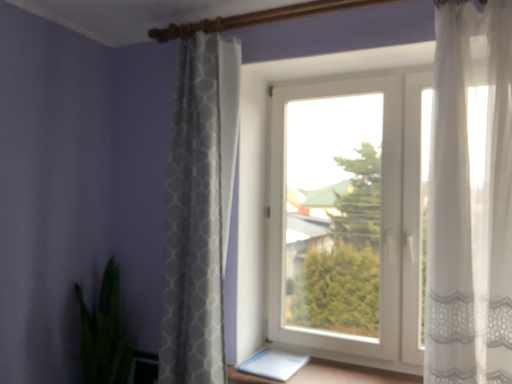
Question: From the image's perspective, would you say white textured curtain at center, which ranks as the first curtain in back-to-front order, is positioned over white plastic window at center?

Choices:
 (A) yes
 (B) no

Answer: (A)

Question: Is white textured curtain at center, which ranks as the first curtain in back-to-front order, oriented away from white plastic window at center?

Choices:
 (A) no
 (B) yes

Answer: (A)

Question: From a real-world perspective, is white textured curtain at center, which is the second curtain in right-to-left order, physically above white plastic window at center?

Choices:
 (A) no
 (B) yes

Answer: (B)

Question: Are white textured curtain at center, which is counted as the 1th curtain, starting from the left, and white plastic window at center located far from each other?

Choices:
 (A) no
 (B) yes

Answer: (A)

Question: Can you confirm if white textured curtain at center, which is counted as the 1th curtain, starting from the left, is smaller than white plastic window at center?

Choices:
 (A) yes
 (B) no

Answer: (A)

Question: Is green leafy plant at lower left to the left or to the right of white textured curtain at center, placed as the 2th curtain when sorted from front to back, in the image?

Choices:
 (A) left
 (B) right

Answer: (A)

Question: Is green leafy plant at lower left taller or shorter than white textured curtain at center, which is the second curtain in right-to-left order?

Choices:
 (A) short
 (B) tall

Answer: (A)

Question: Would you say green leafy plant at lower left is inside or outside white textured curtain at center, which is the second curtain in right-to-left order?

Choices:
 (A) outside
 (B) inside

Answer: (A)

Question: Based on their sizes in the image, would you say green leafy plant at lower left is bigger or smaller than white textured curtain at center, which is the second curtain in right-to-left order?

Choices:
 (A) big
 (B) small

Answer: (B)

Question: Does point (302, 332) appear closer or farther from the camera than point (451, 203)?

Choices:
 (A) farther
 (B) closer

Answer: (A)

Question: Is white plastic window at center inside the boundaries of sheer white curtain at right, placed as the second curtain when sorted from back to front, or outside?

Choices:
 (A) outside
 (B) inside

Answer: (A)

Question: Is white plastic window at center in front of or behind sheer white curtain at right, which is the first curtain in front-to-back order, in the image?

Choices:
 (A) behind
 (B) front

Answer: (A)

Question: From the image's perspective, relative to sheer white curtain at right, acting as the 1th curtain starting from the right, is white plastic window at center above or below?

Choices:
 (A) below
 (B) above

Answer: (A)

Question: In the image, is white plastic window at center on the left side or the right side of green leafy plant at lower left?

Choices:
 (A) right
 (B) left

Answer: (A)

Question: Is white plastic window at center wider or thinner than green leafy plant at lower left?

Choices:
 (A) thin
 (B) wide

Answer: (A)